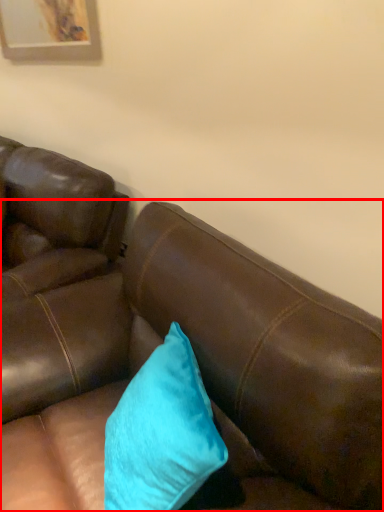
Question: Where is studio couch (annotated by the red box) located in relation to pillow in the image?

Choices:
 (A) left
 (B) right

Answer: (A)